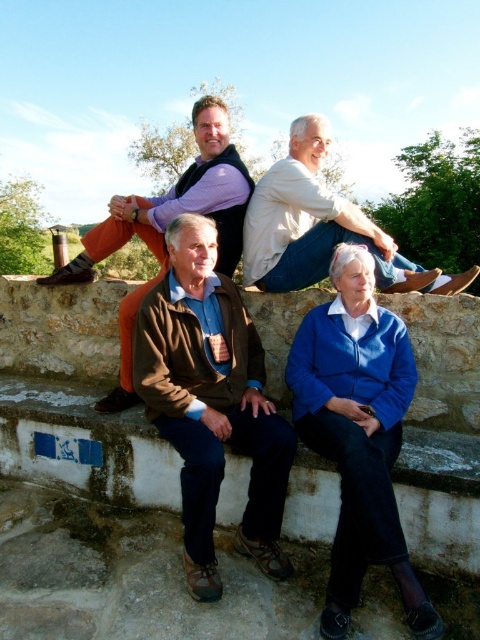
Who is positioned more to the right, brown leather jacket at center or matte purple shirt at upper center?

brown leather jacket at center

Measure the distance between brown leather jacket at center and matte purple shirt at upper center.

brown leather jacket at center is 37.02 inches from matte purple shirt at upper center.

The width and height of the screenshot is (480, 640). Identify the location of brown leather jacket at center. (212, 403).

Can you confirm if light beige sweater at upper center is taller than matte purple shirt at upper center?

Yes.

Measure the distance from light beige sweater at upper center to matte purple shirt at upper center.

light beige sweater at upper center and matte purple shirt at upper center are 5.86 feet apart.

Which is behind, point (299, 211) or point (155, 202)?

The point (155, 202) is more distant.

Identify the location of light beige sweater at upper center. The height and width of the screenshot is (640, 480). 320,227.

Is blue leather jacket at lower right below light beige sweater at upper center?

Indeed, blue leather jacket at lower right is positioned under light beige sweater at upper center.

Find the location of a particular element. This screenshot has height=640, width=480. blue leather jacket at lower right is located at coordinates (358, 433).

Who is more distant from viewer, (340, 260) or (276, 244)?

Positioned behind is point (276, 244).

Identify the location of blue leather jacket at lower right. (358, 433).